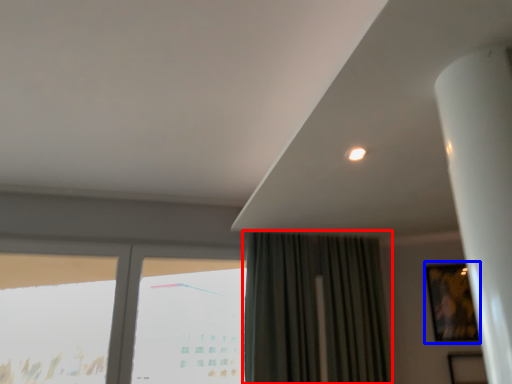
Question: Among these objects, which one is farthest to the camera, curtain (highlighted by a red box) or picture frame (highlighted by a blue box)?

Choices:
 (A) curtain
 (B) picture frame

Answer: (B)